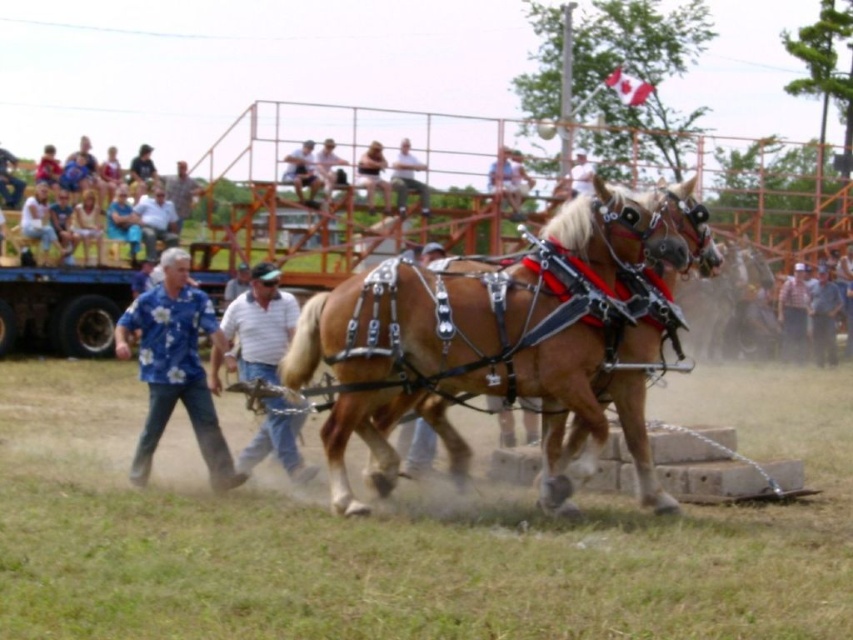
You are a photographer standing at the camera position. You want to capture a closeup of the blue floral shirt at left without moving the camera. Is it possible to do so with a standard zoom lens that has a maximum zoom range of 10 meters?

The blue floral shirt at left is 10.10 meters away from camera. A standard zoom lens with a maximum zoom range of 10 meters cannot reach the subject, so capturing a closeup without moving the camera is not possible.

You are a spectator at the horse plow competition and want to identify the position of the two men guiding the horses. Which man is standing lower in the image, the one wearing the blue floral shirt at left or the light blue shirt at upper center?

The blue floral shirt at left is below light blue shirt at upper center, so the man wearing the blue floral shirt at left is standing lower in the image.